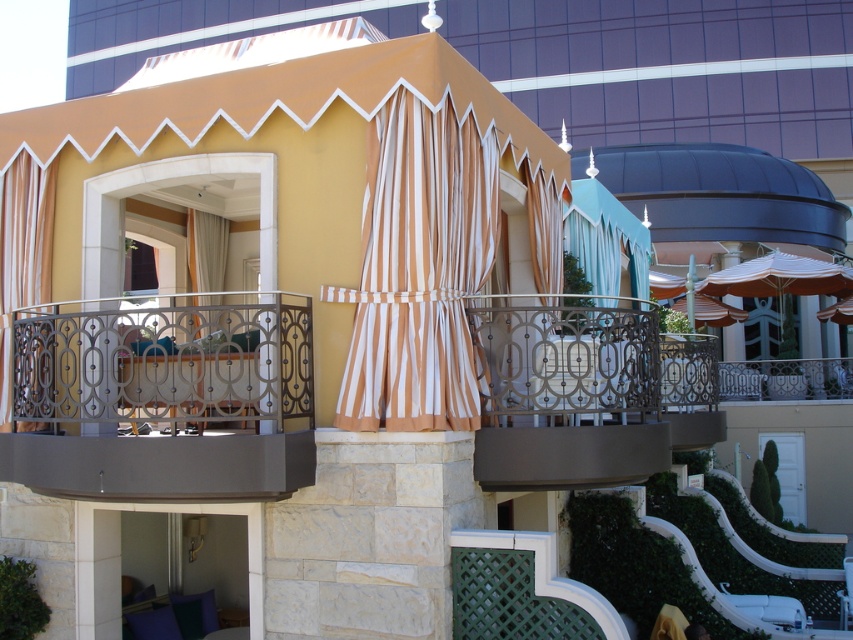
Is the position of metallic wrought iron balcony at left more distant than that of metallic wrought iron at center?

No, metallic wrought iron balcony at left is closer to the viewer.

Can you confirm if metallic wrought iron balcony at left is taller than metallic wrought iron at center?

Yes.

Locate an element on the screen. This screenshot has height=640, width=853. metallic wrought iron balcony at left is located at coordinates (165, 396).

How far apart are beige striped curtain at left and striped fabric curtain at center?

They are 6.17 meters apart.

Does beige striped curtain at left have a lesser height compared to striped fabric curtain at center?

Incorrect, beige striped curtain at left's height does not fall short of striped fabric curtain at center's.

Does point (45, 259) come in front of point (548, 189)?

Yes, it is in front of point (548, 189).

Where is `beige striped curtain at left`? Image resolution: width=853 pixels, height=640 pixels. beige striped curtain at left is located at coordinates (22, 252).

Is metallic wrought iron at center taller than striped fabric curtain at center?

No.

This screenshot has height=640, width=853. What do you see at coordinates (585, 394) in the screenshot?
I see `metallic wrought iron at center` at bounding box center [585, 394].

Identify the location of metallic wrought iron at center. (585, 394).